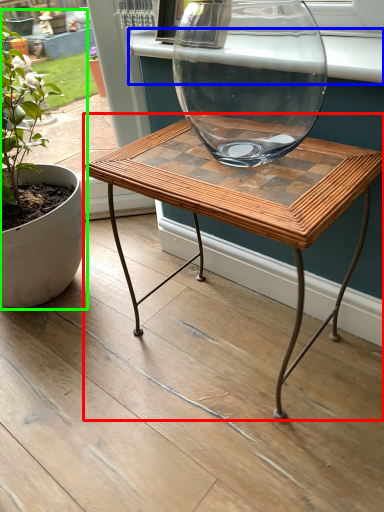
Question: Which is nearer to the coffee table (highlighted by a red box)? window sill (highlighted by a blue box) or houseplant (highlighted by a green box).

Choices:
 (A) window sill
 (B) houseplant

Answer: (A)